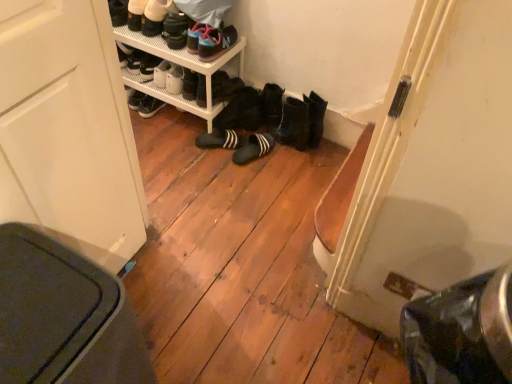
Where is `space that is in front of black suede slippers at center, the second footwear positioned from the bottom`? The image size is (512, 384). space that is in front of black suede slippers at center, the second footwear positioned from the bottom is located at coordinates (208, 159).